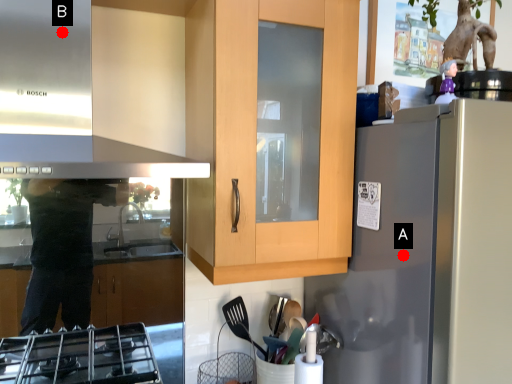
Question: Two points are circled on the image, labeled by A and B beside each circle. Which point is further to the camera?

Choices:
 (A) A is further
 (B) B is further

Answer: (A)